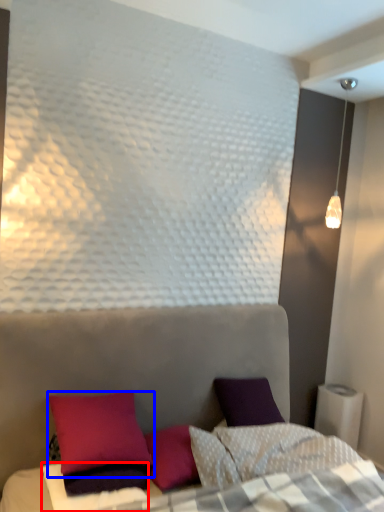
Question: Which object is further to the camera taking this photo, sheet (highlighted by a red box) or pillow (highlighted by a blue box)?

Choices:
 (A) sheet
 (B) pillow

Answer: (B)